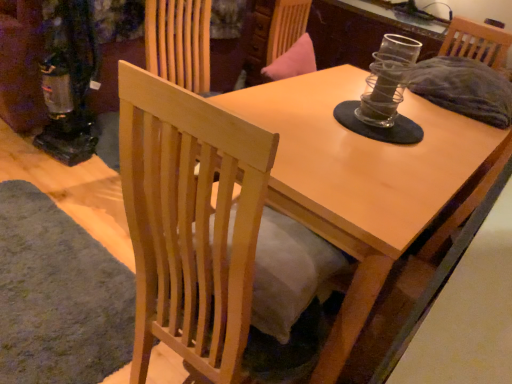
Where is `natural wood chair at center`? The height and width of the screenshot is (384, 512). natural wood chair at center is located at coordinates (189, 222).

In order to face light wood table at center, should I rotate leftwards or rightwards?

You should look right and rotate roughly 10.210 degrees.

Where is `natural wood chair at center`? The image size is (512, 384). natural wood chair at center is located at coordinates (189, 222).

Does natural wood chair at center appear on the right side of soft gray carpet at lower left?

Indeed, natural wood chair at center is positioned on the right side of soft gray carpet at lower left.

Between natural wood chair at center and soft gray carpet at lower left, which one has smaller width?

Thinner between the two is natural wood chair at center.

From a real-world perspective, is natural wood chair at center physically located above or below soft gray carpet at lower left?

From a real-world perspective, natural wood chair at center is physically above soft gray carpet at lower left.

Is point (234, 240) positioned after point (12, 348)?

No, it is in front of (12, 348).

Is soft gray carpet at lower left positioned before natural wood chair at center?

No, the depth of soft gray carpet at lower left is greater than that of natural wood chair at center.

The height and width of the screenshot is (384, 512). In order to click on mat directly beneath the natural wood chair at center (from a real-world perspective) in this screenshot , I will do `click(58, 296)`.

From a real-world perspective, is soft gray carpet at lower left above or below natural wood chair at center?

soft gray carpet at lower left is situated lower than natural wood chair at center in the real world.

Is soft gray carpet at lower left in contact with natural wood chair at center?

soft gray carpet at lower left and natural wood chair at center are not in contact.

From the picture: From a real-world perspective, which is physically above, light wood table at center or natural wood chair at center?

In real-world perspective, natural wood chair at center is above.

How far apart are light wood table at center and natural wood chair at center?

A distance of 21.40 inches exists between light wood table at center and natural wood chair at center.

I want to click on round table below the natural wood chair at center (from a real-world perspective), so click(x=364, y=181).

Is light wood table at center oriented towards natural wood chair at center?

No.

From their relative heights in the image, would you say natural wood chair at center is taller or shorter than light wood table at center?

natural wood chair at center is taller than light wood table at center.

Image resolution: width=512 pixels, height=384 pixels. What are the coordinates of `chair on the left of light wood table at center` in the screenshot? It's located at (189, 222).

From the image's perspective, does natural wood chair at center appear higher than light wood table at center?

No.

Is natural wood chair at center far from light wood table at center?

They are positioned close to each other.

Is soft gray carpet at lower left at the back of light wood table at center?

No, light wood table at center's orientation is not away from soft gray carpet at lower left.

Is the surface of light wood table at center in direct contact with soft gray carpet at lower left?

light wood table at center is not next to soft gray carpet at lower left, and they're not touching.

Considering the sizes of objects light wood table at center and soft gray carpet at lower left in the image provided, who is taller, light wood table at center or soft gray carpet at lower left?

Standing taller between the two is light wood table at center.

Can you confirm if light wood table at center is positioned to the left of soft gray carpet at lower left?

No.

Is soft gray carpet at lower left inside or outside of light wood table at center?

soft gray carpet at lower left is not enclosed by light wood table at center.

Is soft gray carpet at lower left looking in the opposite direction of light wood table at center?

That's not correct — soft gray carpet at lower left is not looking away from light wood table at center.

Between soft gray carpet at lower left and light wood table at center, which one has larger width?

light wood table at center.

Based on their sizes in the image, would you say soft gray carpet at lower left is bigger or smaller than light wood table at center?

Considering their sizes, soft gray carpet at lower left takes up less space than light wood table at center.

Find the location of a particular element. This screenshot has height=384, width=512. chair on the right of soft gray carpet at lower left is located at coordinates (189, 222).

Locate an element on the screen. The image size is (512, 384). chair that appears above the soft gray carpet at lower left (from a real-world perspective) is located at coordinates (189, 222).

Considering their positions, is light wood table at center positioned further to natural wood chair at center than soft gray carpet at lower left?

Among the two, soft gray carpet at lower left is located further to natural wood chair at center.

From the image, which object appears to be nearer to soft gray carpet at lower left, natural wood chair at center or light wood table at center?

The object closer to soft gray carpet at lower left is natural wood chair at center.

Which object lies nearer to the anchor point soft gray carpet at lower left, light wood table at center or natural wood chair at center?

natural wood chair at center.

Considering their positions, is soft gray carpet at lower left positioned closer to natural wood chair at center than light wood table at center?

Based on the image, light wood table at center appears to be nearer to natural wood chair at center.

Looking at the image, which one is located further to light wood table at center, soft gray carpet at lower left or natural wood chair at center?

Based on the image, soft gray carpet at lower left appears to be further to light wood table at center.

Looking at the image, which one is located further to light wood table at center, natural wood chair at center or soft gray carpet at lower left?

Based on the image, soft gray carpet at lower left appears to be further to light wood table at center.

I want to click on chair situated between soft gray carpet at lower left and light wood table at center from left to right, so (189, 222).